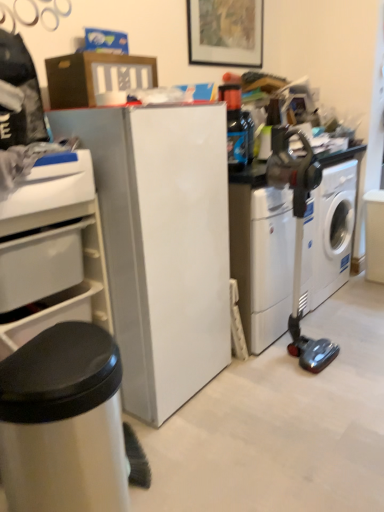
Question: Is translucent plastic bottle at upper center taller than white glossy refrigerator at center?

Choices:
 (A) yes
 (B) no

Answer: (B)

Question: Is white glossy refrigerator at center a part of translucent plastic bottle at upper center?

Choices:
 (A) yes
 (B) no

Answer: (B)

Question: Considering the relative sizes of translucent plastic bottle at upper center and white glossy refrigerator at center in the image provided, is translucent plastic bottle at upper center thinner than white glossy refrigerator at center?

Choices:
 (A) no
 (B) yes

Answer: (B)

Question: Would you say translucent plastic bottle at upper center is outside white glossy refrigerator at center?

Choices:
 (A) yes
 (B) no

Answer: (A)

Question: Can you confirm if translucent plastic bottle at upper center is positioned to the right of white glossy refrigerator at center?

Choices:
 (A) yes
 (B) no

Answer: (A)

Question: Does translucent plastic bottle at upper center have a greater width compared to white glossy refrigerator at center?

Choices:
 (A) yes
 (B) no

Answer: (B)

Question: From a real-world perspective, is white plastic washing machine at center-right, the first washing machine in the left-to-right sequence, under white glossy washing machine at right, positioned as the first washing machine in right-to-left order?

Choices:
 (A) yes
 (B) no

Answer: (B)

Question: Considering the relative sizes of white plastic washing machine at center-right, the first washing machine in the left-to-right sequence, and white glossy washing machine at right, marked as the second washing machine in a left-to-right arrangement, in the image provided, is white plastic washing machine at center-right, the first washing machine in the left-to-right sequence, shorter than white glossy washing machine at right, marked as the second washing machine in a left-to-right arrangement,?

Choices:
 (A) no
 (B) yes

Answer: (A)

Question: Is white plastic washing machine at center-right, placed as the second washing machine when sorted from right to left, placed right next to white glossy washing machine at right, marked as the second washing machine in a left-to-right arrangement?

Choices:
 (A) yes
 (B) no

Answer: (B)

Question: Does white plastic washing machine at center-right, the first washing machine in the left-to-right sequence, turn towards white glossy washing machine at right, positioned as the first washing machine in right-to-left order?

Choices:
 (A) no
 (B) yes

Answer: (A)

Question: Is white glossy washing machine at right, marked as the second washing machine in a left-to-right arrangement, surrounded by white plastic washing machine at center-right, the first washing machine in the left-to-right sequence?

Choices:
 (A) yes
 (B) no

Answer: (B)

Question: From a real-world perspective, is white plastic washing machine at center-right, placed as the second washing machine when sorted from right to left, physically above white glossy washing machine at right, positioned as the first washing machine in right-to-left order?

Choices:
 (A) yes
 (B) no

Answer: (A)

Question: From a real-world perspective, is white plastic drawer at left over white plastic drawer at lower left?

Choices:
 (A) no
 (B) yes

Answer: (A)